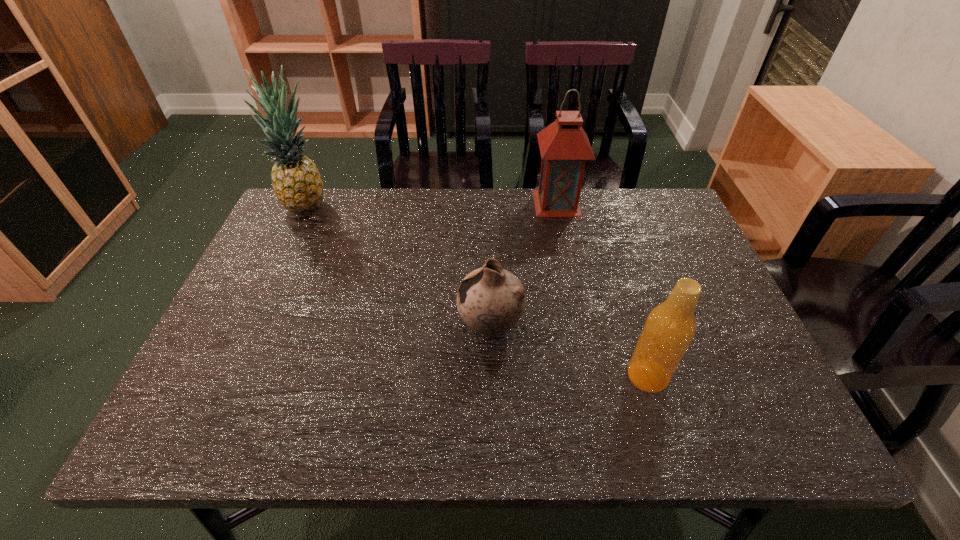
I want to click on the second closest object to the leftmost object, so click(x=564, y=146).

Locate an element on the screen. vacant point that satisfies the following two spatial constraints: 1. from the spout of the third farthest object; 2. on the left side of the nearest object is located at coordinates (492, 376).

The width and height of the screenshot is (960, 540). Find the location of `free space that satisfies the following two spatial constraints: 1. from the spout of the beer bottle; 2. on the right side of the second nearest object`. free space that satisfies the following two spatial constraints: 1. from the spout of the beer bottle; 2. on the right side of the second nearest object is located at coordinates (492, 376).

Where is `vacant space that satisfies the following two spatial constraints: 1. from the spout of the beer bottle; 2. on the right side of the shortest object`? The height and width of the screenshot is (540, 960). vacant space that satisfies the following two spatial constraints: 1. from the spout of the beer bottle; 2. on the right side of the shortest object is located at coordinates [492, 376].

Image resolution: width=960 pixels, height=540 pixels. In order to click on vacant point that satisfies the following two spatial constraints: 1. on the front side of the lantern; 2. from the spout of the second object from left to right in this screenshot , I will do `click(583, 326)`.

Locate an element on the screen. This screenshot has width=960, height=540. vacant space that satisfies the following two spatial constraints: 1. on the front side of the lantern; 2. from the spout of the second object from left to right is located at coordinates (583, 326).